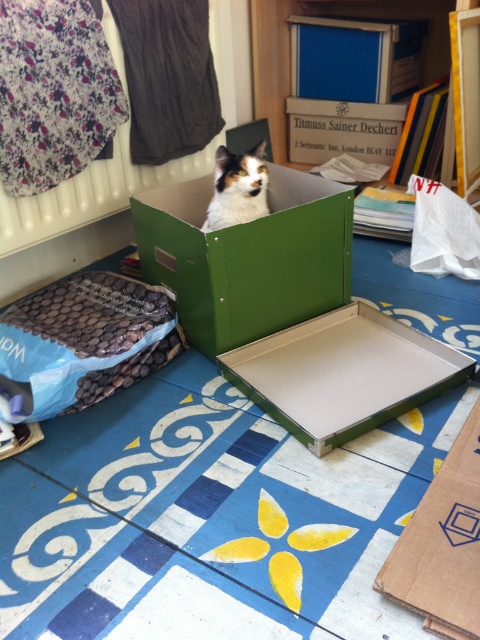
Between green cardboard box at center and brown cardboard box at lower right, which one is positioned lower?

brown cardboard box at lower right

Is green cardboard box at center bigger than brown cardboard box at lower right?

Correct, green cardboard box at center is larger in size than brown cardboard box at lower right.

Image resolution: width=480 pixels, height=640 pixels. Describe the element at coordinates (248, 257) in the screenshot. I see `green cardboard box at center` at that location.

Image resolution: width=480 pixels, height=640 pixels. What are the coordinates of `green cardboard box at center` in the screenshot? It's located at (248, 257).

Consider the image. Who is more forward, (345, 394) or (460, 532)?

Point (460, 532)

Which is below, green cardboard tray at center or brown cardboard box at lower right?

brown cardboard box at lower right is below.

Does point (315, 323) lie in front of point (423, 621)?

No.

The width and height of the screenshot is (480, 640). What are the coordinates of `green cardboard tray at center` in the screenshot? It's located at (343, 372).

At what (x,y) coordinates should I click in order to perform the action: click on brown cardboard box at lower right. Please return your answer as a coordinate pair (x, y). Image resolution: width=480 pixels, height=640 pixels. Looking at the image, I should click on (443, 545).

Does point (467, 481) lie in front of point (216, 189)?

Yes, point (467, 481) is in front of point (216, 189).

Locate an element on the screen. Image resolution: width=480 pixels, height=640 pixels. brown cardboard box at lower right is located at coordinates (x=443, y=545).